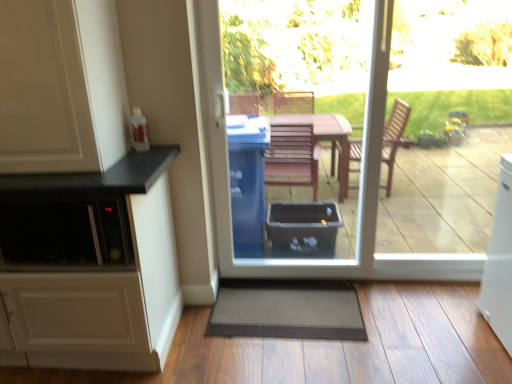
The image size is (512, 384). What are the coordinates of `free space in front of gray textured mat at lower center` in the screenshot? It's located at pyautogui.click(x=296, y=363).